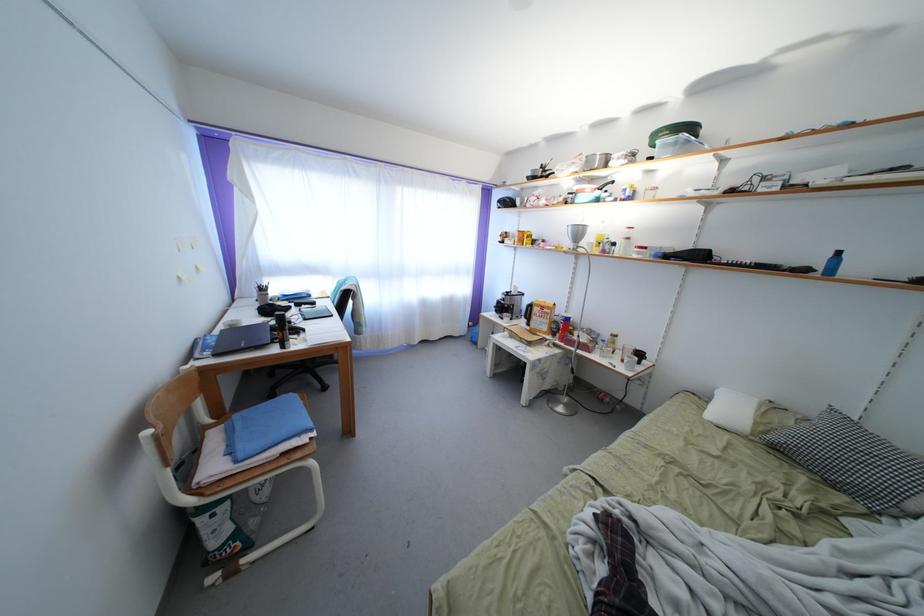
Where would you lift the white pillow? Please return your answer as a coordinate pair (x, y).

(855, 462)